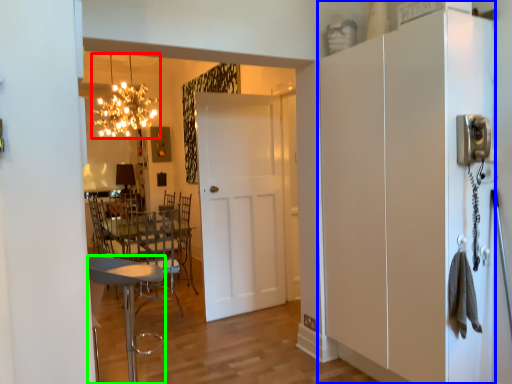
Question: Based on their relative distances, which object is farther from light fixture (highlighted by a red box)? Choose from cabinetry (highlighted by a blue box) and chair (highlighted by a green box).

Choices:
 (A) cabinetry
 (B) chair

Answer: (A)